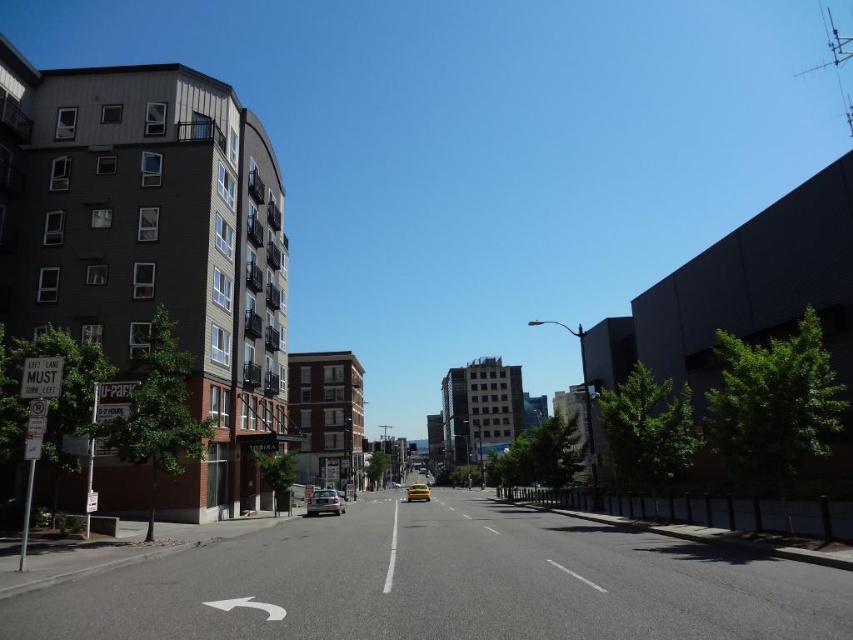
You are a pedestrian standing at the middle of the road and want to cross to the other side. There are two vehicles in front of you, a silver metallic sedan at center and a yellow matte taxi at center. Which vehicle is blocking your path more directly?

The silver metallic sedan at center is positioned over the yellow matte taxi at center, so it is blocking your path more directly as it is closer to you.

You are a delivery person trying to park your 1.5m tall delivery box between the silver metallic sedan at center and the yellow matte taxi at center. Can the delivery box fit vertically between them?

The silver metallic sedan at center has a lesser height compared to yellow matte taxi at center. Since the delivery box is 1.5m tall, it can fit vertically between them as the height difference allows space.

You are a pedestrian standing at the edge of the road and want to cross to the opposite sidewalk. There is a silver metallic sedan at center and a yellow matte taxi at center in your path. Can you safely cross the road without waiting for the traffic to stop?

The silver metallic sedan at center and yellow matte taxi at center are 88.14 meters apart, so there is enough space between them for a pedestrian to cross safely without waiting for traffic to stop.